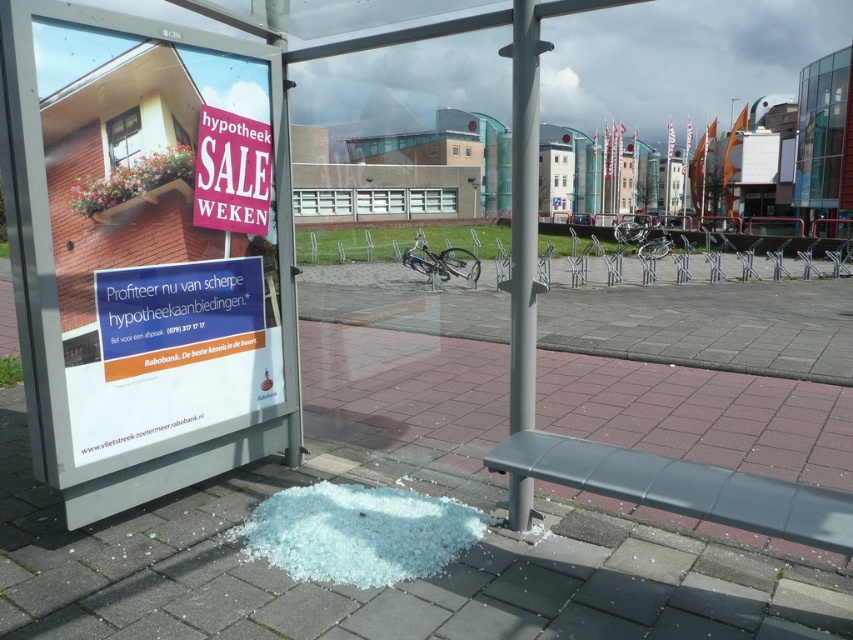
You are a delivery person standing at the bus stop shelter. You need to place a fragile package on the ground without it breaking. The package requires a safe spot that is at least 10 feet away from the camera. Is the point at coordinates point (x=54, y=58) suitable for placing the package?

The distance of point (x=54, y=58) from the camera is 8.54 feet, which is less than the required 10 feet. Therefore, placing the package there would not be safe as it is too close to the camera.